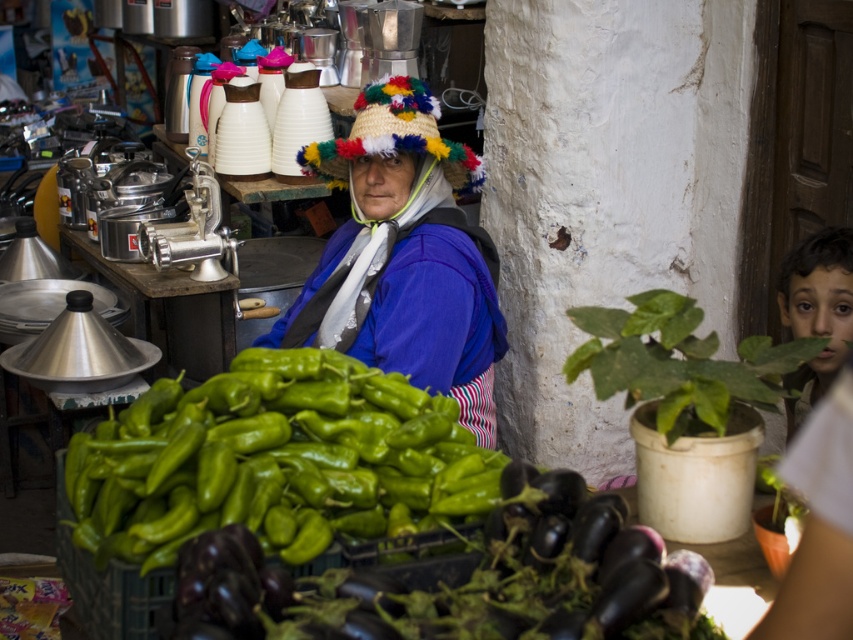
You are a customer at this market and want to buy the green matte eggplant at center. The vendor is standing behind the brown hair at right. To reach the eggplant, do you need to walk around the vendor or can you reach it directly?

The green matte eggplant at center is shorter than the brown hair at right, so the eggplant is shorter than the vendor. Since the eggplant is shorter than the vendor, you would need to walk around the vendor to reach it directly, as it might be blocked by the vendor.

You are a customer at the market and want to compare the size of the green matte eggplant at center and the brown hair at right. Which one is wider?

The green matte eggplant at center is wider than the brown hair at right.